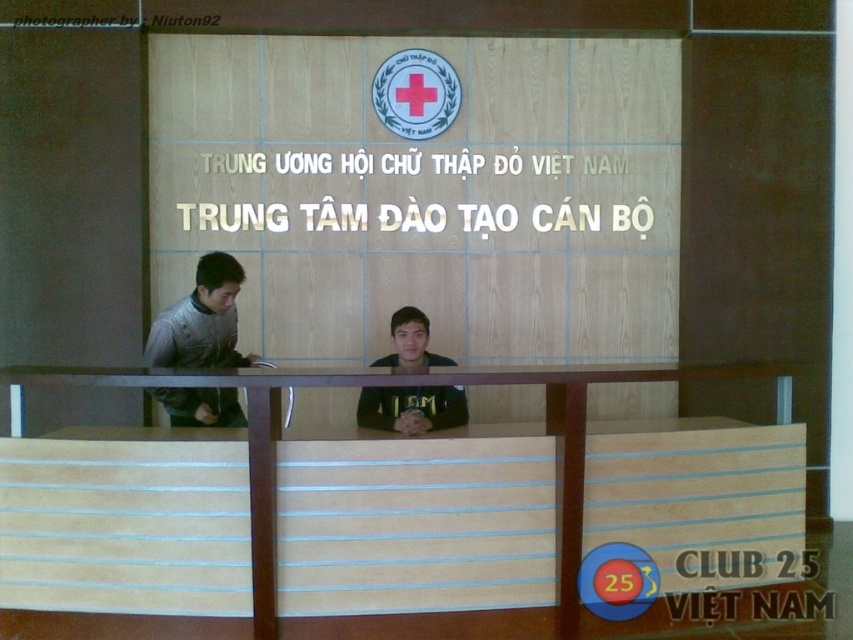
Between point (143, 360) and point (380, 420), which one is positioned in front?

Point (143, 360)

The height and width of the screenshot is (640, 853). Find the location of `gray matte jacket at left`. gray matte jacket at left is located at coordinates click(x=201, y=321).

Is light brown wood table at center bigger than gray matte jacket at left?

Indeed, light brown wood table at center has a larger size compared to gray matte jacket at left.

Which is more to the right, light brown wood table at center or gray matte jacket at left?

light brown wood table at center

What are the coordinates of `light brown wood table at center` in the screenshot? It's located at (415, 384).

Is light brown wood table at center wider than black matte shirt at center?

Yes.

Who is lower down, light brown wood table at center or black matte shirt at center?

light brown wood table at center is lower down.

Is point (556, 422) positioned behind point (389, 364)?

No, it is in front of (389, 364).

Locate an element on the screen. light brown wood table at center is located at coordinates (415, 384).